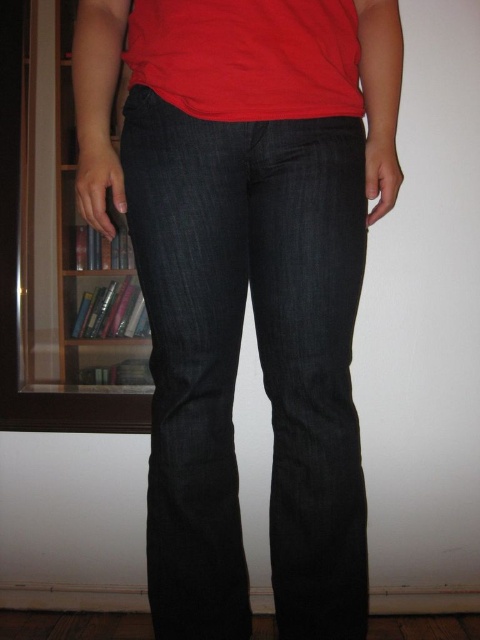
Does wooden bookshelf at left have a larger size compared to matte red t-shirt at upper center?

Yes.

Identify the location of wooden bookshelf at left. (70, 243).

Who is taller, dark denim jeans at center or wooden bookshelf at left?

With more height is wooden bookshelf at left.

Can you confirm if dark denim jeans at center is thinner than wooden bookshelf at left?

No.

Is point (229, 230) positioned in front of point (66, 26)?

Yes, point (229, 230) is in front of point (66, 26).

Identify the location of dark denim jeans at center. This screenshot has height=640, width=480. (260, 360).

Is point (354, 472) farther from camera compared to point (142, 17)?

Yes, point (354, 472) is behind point (142, 17).

Which is below, dark denim jeans at center or matte red t-shirt at upper center?

dark denim jeans at center

Where is `dark denim jeans at center`? The image size is (480, 640). dark denim jeans at center is located at coordinates (260, 360).